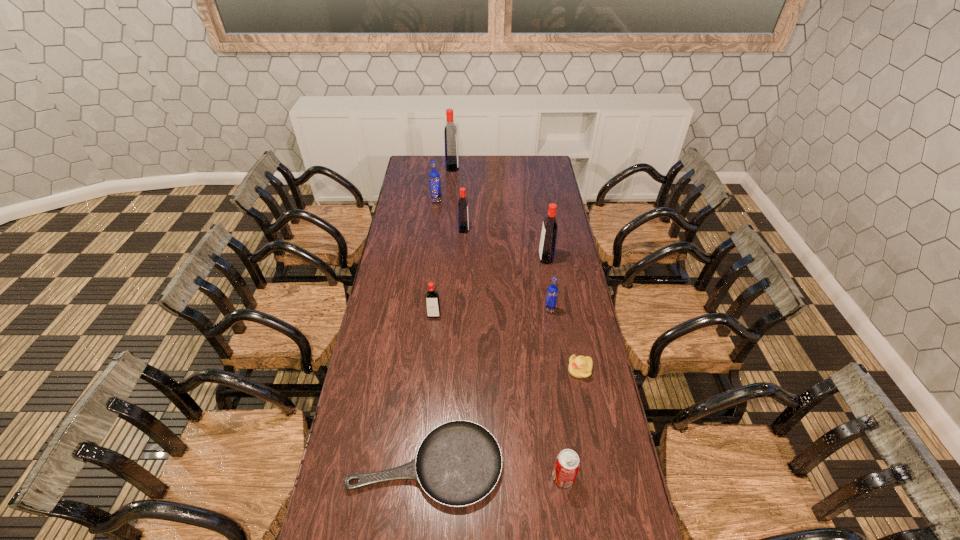
Locate an element on the screen. This screenshot has width=960, height=540. vacant space located on the front of the second farthest object is located at coordinates (432, 238).

Find the location of a particular element. vacant space located 0.080m on the front and back of the third farthest object is located at coordinates (485, 230).

Locate an element on the screen. Image resolution: width=960 pixels, height=540 pixels. free location located on the left of the smaller blue vodka is located at coordinates (468, 309).

Locate an element on the screen. free region located 0.070m on the front and back of the smallest red vodka is located at coordinates (432, 332).

Where is `vacant space situated 0.240m on the back of the seventh tallest object`? The image size is (960, 540). vacant space situated 0.240m on the back of the seventh tallest object is located at coordinates (553, 397).

The image size is (960, 540). In order to click on free space located 0.260m on the beak of the duckling in this screenshot , I will do `click(497, 370)`.

Find the location of a particular element. vacant space situated on the beak of the duckling is located at coordinates click(x=476, y=370).

You are a GUI agent. You are given a task and a screenshot of the screen. Output one action in this format:
    pyautogui.click(x=<x>, y=<y>)
    Task: Click on the vacant space located on the beak of the duckling
    
    Given the screenshot: What is the action you would take?
    pyautogui.click(x=530, y=370)

Locate an element on the screen. Image resolution: width=960 pixels, height=540 pixels. vacant space located 0.150m on the back of the shortest object is located at coordinates (433, 385).

I want to click on object present at the far edge, so click(x=450, y=132).